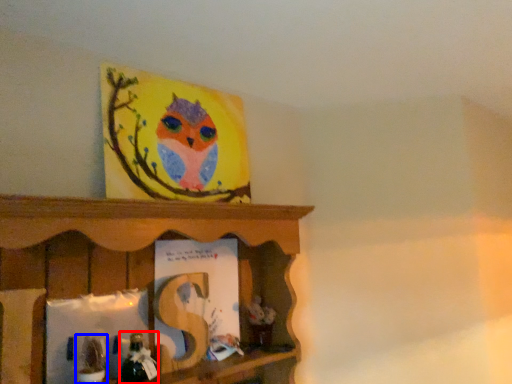
Question: Which point is further to the camera, toy (highlighted by a red box) or toy (highlighted by a blue box)?

Choices:
 (A) toy
 (B) toy

Answer: (A)